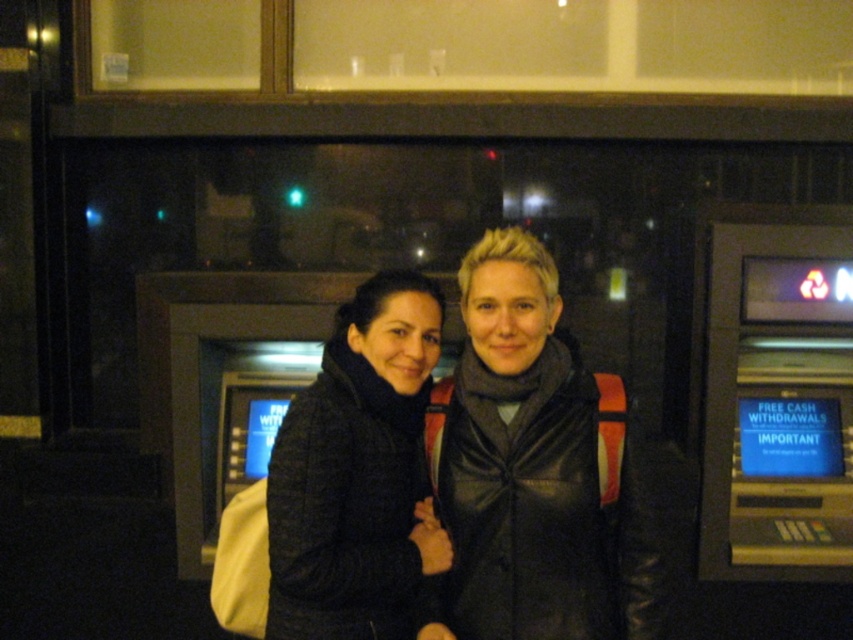
Is dark gray leather jacket at center wider than black fuzzy coat at center?

Yes, dark gray leather jacket at center is wider than black fuzzy coat at center.

Is point (555, 268) closer to viewer compared to point (312, 456)?

No, (555, 268) is behind (312, 456).

Between point (485, 241) and point (410, 387), which one is positioned in front?

Point (485, 241)

Where is `dark gray leather jacket at center`? This screenshot has height=640, width=853. dark gray leather jacket at center is located at coordinates (534, 472).

Does point (758, 467) come farther from viewer compared to point (421, 548)?

That is True.

Where is `metallic gray slot machine at right`? metallic gray slot machine at right is located at coordinates (776, 404).

Identify the location of metallic gray slot machine at right. Image resolution: width=853 pixels, height=640 pixels. (776, 404).

You are a GUI agent. You are given a task and a screenshot of the screen. Output one action in this format:
    pyautogui.click(x=<x>, y=<y>)
    Task: Click on the metallic gray slot machine at right
    
    Given the screenshot: What is the action you would take?
    pyautogui.click(x=776, y=404)

Is point (434, 636) behind point (790, 371)?

No.

Can you confirm if dark gray leather jacket at center is positioned below metallic gray slot machine at right?

Correct, dark gray leather jacket at center is located below metallic gray slot machine at right.

Who is more forward, (585, 461) or (836, 392)?

Point (585, 461) is in front.

This screenshot has width=853, height=640. I want to click on dark gray leather jacket at center, so click(534, 472).